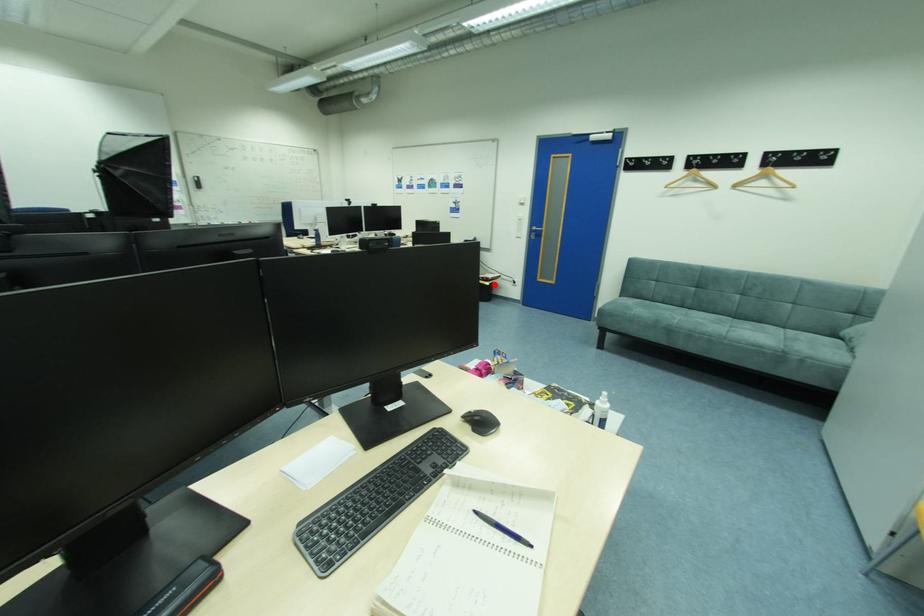
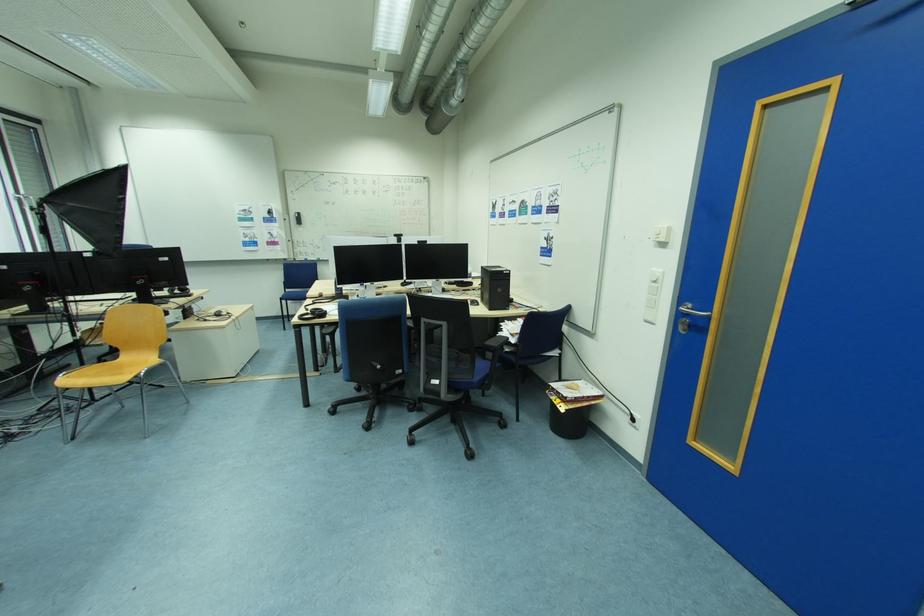
Question: I am providing you with two images of the same scene from different viewpoints. A red point is shown in image1. For the corresponding object point in image2, is it positioned nearer or farther from the camera?

Choices:
 (A) Nearer
 (B) Farther

Answer: (B)